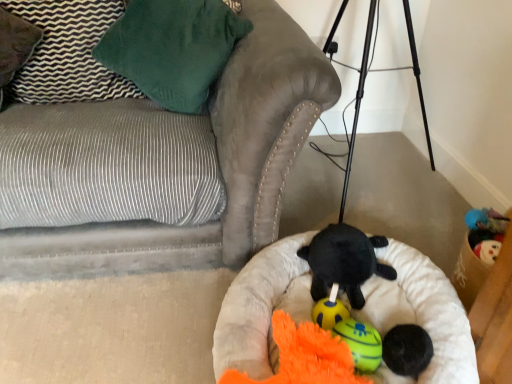
Question: Would you say orange plush toy at center, the 3th toy in the front-to-back sequence, is to the left or to the right of suede gray couch at lower left in the picture?

Choices:
 (A) left
 (B) right

Answer: (B)

Question: Is point (342, 329) positioned closer to the camera than point (228, 241)?

Choices:
 (A) farther
 (B) closer

Answer: (B)

Question: Which of these objects is positioned closest to the soft beige dog bed at center?

Choices:
 (A) velvet green pillow at upper left, which is the first pillow in left-to-right order
 (B) black plush turtle at center, which is the 2th toy from back to front
 (C) soft black ball at center, which is the 4th toy from back to front
 (D) orange fuzzy toy at center, arranged as the 5th toy when viewed from the back
 (E) suede gray couch at lower left

Answer: (B)

Question: Estimate the real-world distances between objects in this image. Which object is closer to the orange fuzzy toy at center, arranged as the 5th toy when viewed from the back?

Choices:
 (A) soft black ball at center, which is the 4th toy from back to front
 (B) rubber ball at center, arranged as the first toy when viewed from the back
 (C) velvet green pillow at upper left, which is the first pillow in left-to-right order
 (D) orange plush toy at center, the 3th toy in the front-to-back sequence
 (E) green soft pillow at upper left, which appears as the 2th pillow when viewed from the left

Answer: (D)